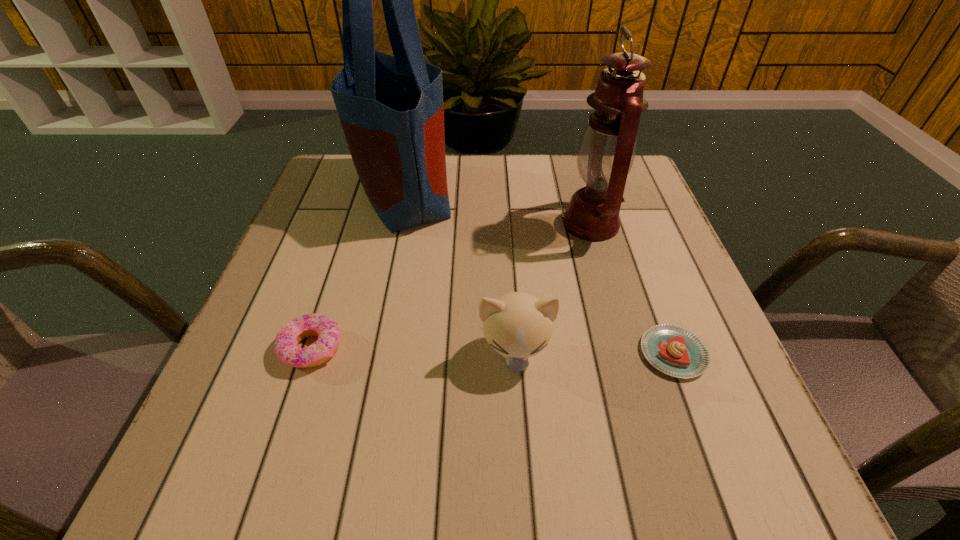
The image size is (960, 540). Identify the location of handbag. (x=391, y=109).

Image resolution: width=960 pixels, height=540 pixels. I want to click on oil lamp, so click(x=607, y=149).

The image size is (960, 540). In order to click on the third object from left to right in this screenshot , I will do `click(517, 325)`.

You are a GUI agent. You are given a task and a screenshot of the screen. Output one action in this format:
    pyautogui.click(x=<x>, y=<y>)
    Task: Click on the kitten
    The width and height of the screenshot is (960, 540).
    Given the screenshot: What is the action you would take?
    pyautogui.click(x=517, y=325)

Identify the location of the second shortest object. (286, 348).

The height and width of the screenshot is (540, 960). In order to click on pastry in this screenshot , I will do `click(675, 351)`.

Where is `vacant point located 0.210m on the front of the handbag`? vacant point located 0.210m on the front of the handbag is located at coordinates (380, 306).

At what (x,y) coordinates should I click in order to perform the action: click on free space located on the left of the oil lamp. Please return your answer as a coordinate pair (x, y). The width and height of the screenshot is (960, 540). Looking at the image, I should click on (492, 224).

Find the location of `vacant area located 0.070m on the face of the third object from left to right`. vacant area located 0.070m on the face of the third object from left to right is located at coordinates (519, 420).

What are the coordinates of `free space located 0.070m on the front of the doughnut` in the screenshot? It's located at (289, 415).